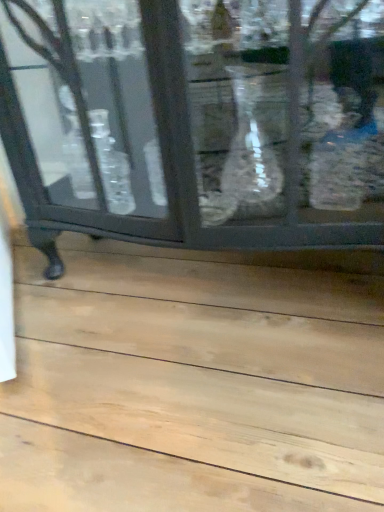
Locate an element on the screen. free point below matte glass cabinet at center (from a real-world perspective) is located at coordinates (207, 277).